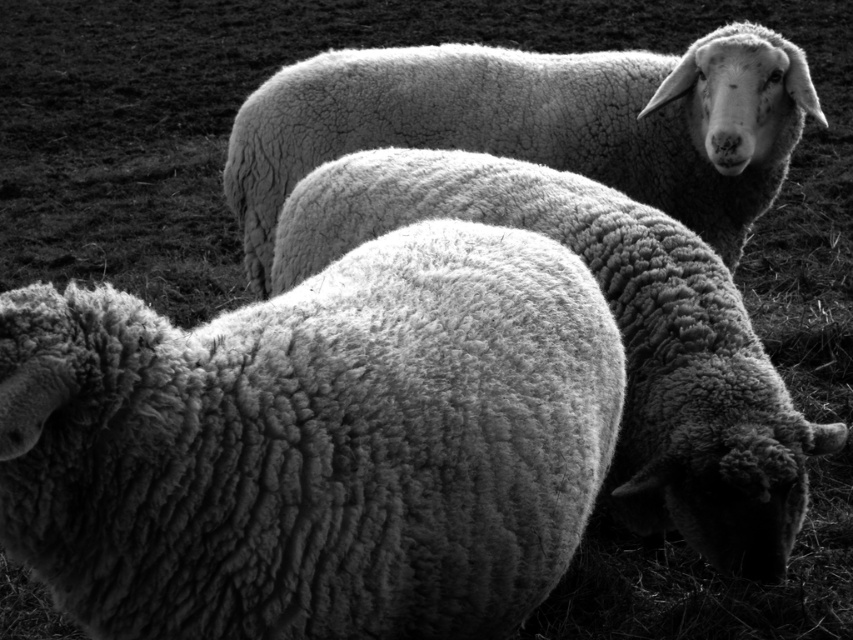
Question: Is fuzzy woolly sheep at center above fuzzy woolen sheep at upper center?

Choices:
 (A) yes
 (B) no

Answer: (B)

Question: Among these objects, which one is nearest to the camera?

Choices:
 (A) fuzzy woolen sheep at upper center
 (B) fuzzy woolen sheep at center

Answer: (B)

Question: Is fuzzy woolly sheep at center thinner than fuzzy woolen sheep at upper center?

Choices:
 (A) no
 (B) yes

Answer: (B)

Question: Which point is farther from the camera taking this photo?

Choices:
 (A) (695, 177)
 (B) (347, 177)
 (C) (25, 506)

Answer: (A)

Question: Among these objects, which one is farthest from the camera?

Choices:
 (A) fuzzy woolly sheep at center
 (B) fuzzy woolen sheep at upper center

Answer: (B)

Question: Where is fuzzy woolen sheep at center located in relation to fuzzy woolen sheep at upper center in the image?

Choices:
 (A) below
 (B) above

Answer: (A)